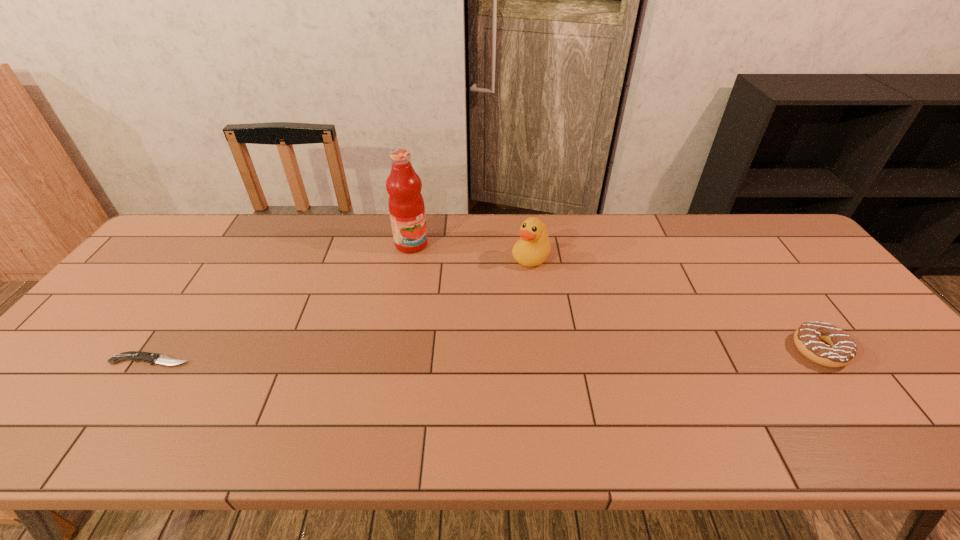
At what (x,y) coordinates should I click in order to perform the action: click on vacant space on the desktop that is between the pocketknife and the third tallest object and is positioned on the front label of the second object from left to right. Please return your answer as a coordinate pair (x, y). This screenshot has width=960, height=540. Looking at the image, I should click on (575, 354).

Locate an element on the screen. This screenshot has height=540, width=960. vacant space on the desktop that is between the leftmost object and the doughnut and is positioned at the beak of the third shortest object is located at coordinates (447, 356).